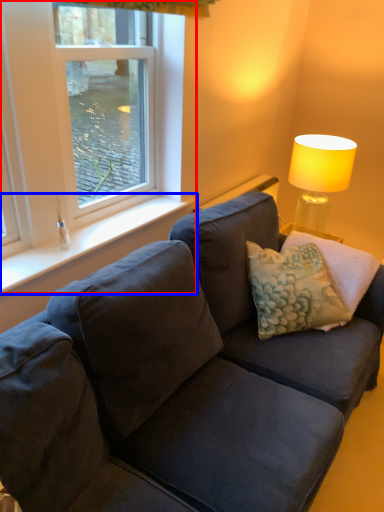
Question: Which object appears farthest to the camera in this image, window (highlighted by a red box) or window sill (highlighted by a blue box)?

Choices:
 (A) window
 (B) window sill

Answer: (B)